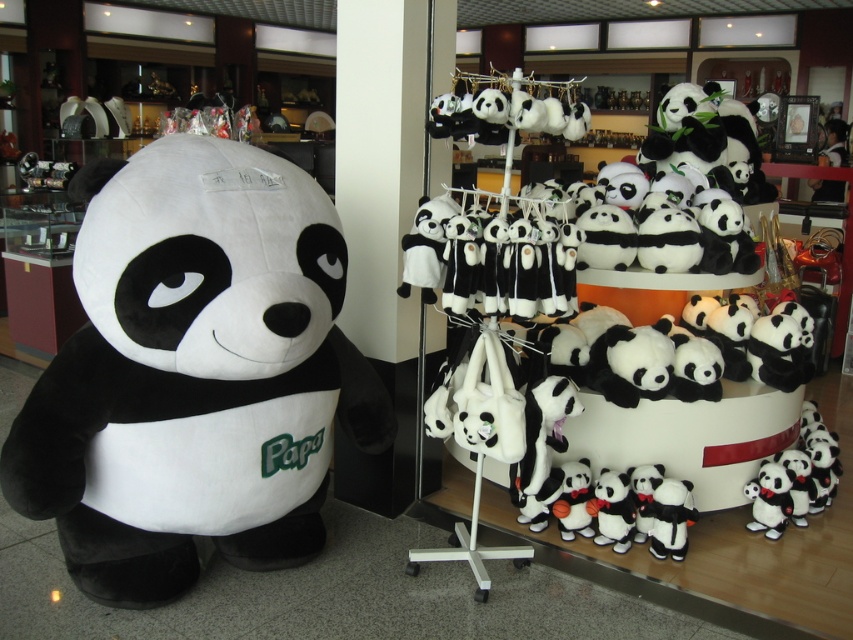
You are a customer in a panda merchandise store and want to pick up the soft plush panda at lower right. However, there is another soft plush panda at center in the way. Can you reach the one you want without moving the one in front?

The soft plush panda at center is positioned over the soft plush panda at lower right, so you cannot reach the one at lower right without moving the one in front.

Based on the photo, you are a customer in the store and want to pick up the soft plush panda at left. If your maximum reach is 2 meters, can you grab it without moving closer?

The soft plush panda at left is 2.01 meters away from the viewer. Since your maximum reach is 2 meters, you cannot grab it without moving closer.

You are a customer in a panda merchandise store. You want to buy the Papa plush panda. The store uses a coordinate system where the bottom left corner is the origin. The coordinates of the Papa plush panda are given as point (194, 372). If you are standing at the origin, which direction should you walk to reach the Papa plush panda?

The Papa plush panda is located at point (194, 372). Since the coordinate system has the origin at the bottom left corner, the x and y values increase to the right and upwards respectively. Therefore, to reach the Papa plush panda from the origin, you should walk diagonally northeast, moving both to the right and slightly forward.